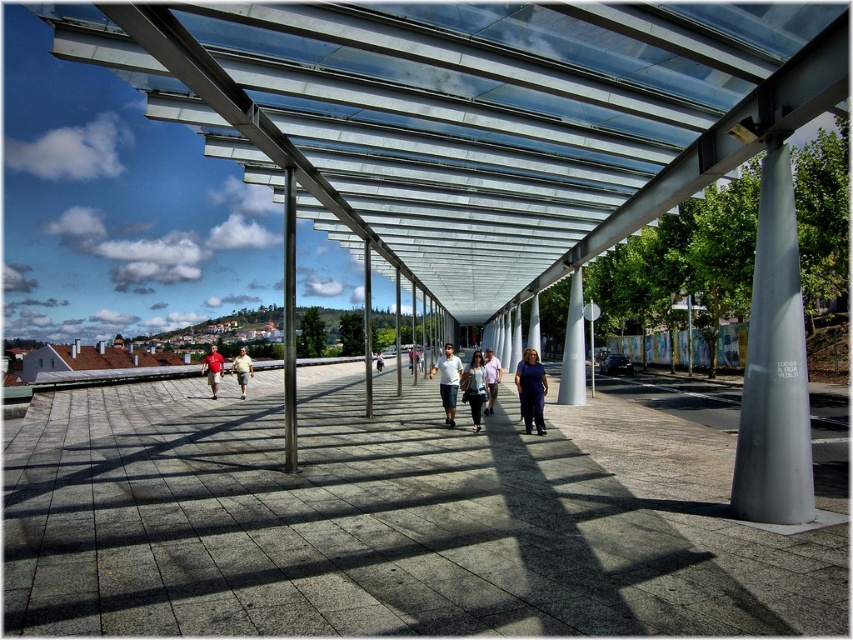
Who is taller, matte white shirt at center or light brown fabric shirt at left?

light brown fabric shirt at left

Image resolution: width=853 pixels, height=640 pixels. I want to click on matte white shirt at center, so click(491, 378).

The image size is (853, 640). Identify the location of matte white shirt at center. (491, 378).

Between gray concrete path at center and matte blue dress at center, which one is positioned lower?

gray concrete path at center is below.

Between point (506, 544) and point (532, 374), which one is positioned behind?

The point (532, 374) is more distant.

Between point (263, 500) and point (526, 401), which one is positioned in front?

Point (263, 500)

At what (x,y) coordinates should I click in order to perform the action: click on gray concrete path at center. Please return your answer as a coordinate pair (x, y). Looking at the image, I should click on (386, 522).

Which is below, satin silver column at right or red shirt at left?

red shirt at left is lower down.

Can you confirm if satin silver column at right is positioned above red shirt at left?

Yes, satin silver column at right is above red shirt at left.

Where is `satin silver column at right`? Image resolution: width=853 pixels, height=640 pixels. satin silver column at right is located at coordinates (775, 365).

You are a GUI agent. You are given a task and a screenshot of the screen. Output one action in this format:
    pyautogui.click(x=<x>, y=<y>)
    Task: Click on the satin silver column at right
    The image size is (853, 640).
    Given the screenshot: What is the action you would take?
    pyautogui.click(x=775, y=365)